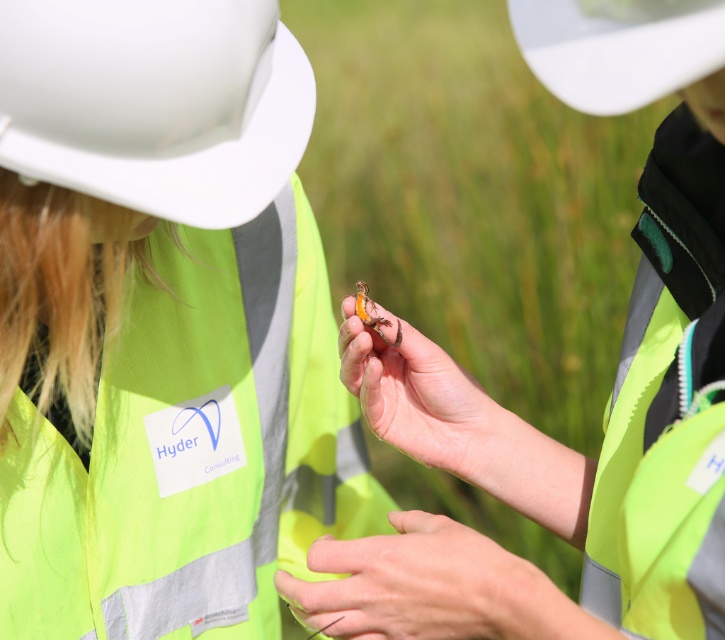
Question: Is white matte hard hat at upper left wider than white matte hard hat at upper center?

Choices:
 (A) yes
 (B) no

Answer: (A)

Question: Which point is closer to the camera taking this photo?

Choices:
 (A) (254, 216)
 (B) (269, 115)
 (C) (616, 88)
 (D) (708, 401)

Answer: (C)

Question: Does white matte hard hat at upper center appear on the left side of translucent orange insect at center?

Choices:
 (A) yes
 (B) no

Answer: (B)

Question: Which point is closer to the camera?

Choices:
 (A) white matte hard hat at upper left
 (B) translucent orange insect at center

Answer: (A)

Question: Considering the relative positions of smooth yellow-green vest at lower center and translucent orange insect at center in the image provided, where is smooth yellow-green vest at lower center located with respect to translucent orange insect at center?

Choices:
 (A) above
 (B) below

Answer: (B)

Question: Among these objects, which one is nearest to the camera?

Choices:
 (A) orange matte rock at center
 (B) white matte hard hat at upper center
 (C) translucent orange insect at center
 (D) white matte hard hat at upper left

Answer: (B)